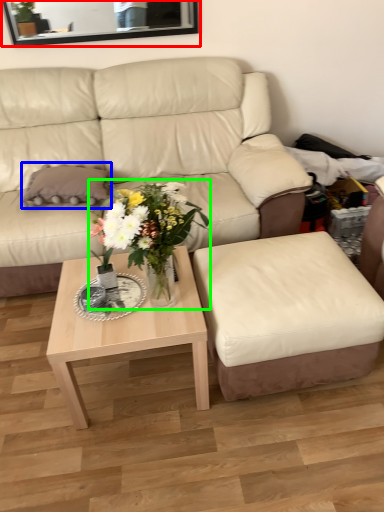
Question: Considering the real-world distances, which object is farthest from mirror (highlighted by a red box)? pillow (highlighted by a blue box) or houseplant (highlighted by a green box)?

Choices:
 (A) pillow
 (B) houseplant

Answer: (B)